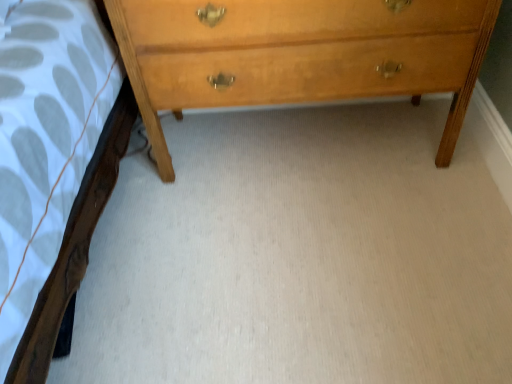
Question: Which direction should I rotate to look at light brown wood chest of drawers at upper center?

Choices:
 (A) right
 (B) left

Answer: (A)